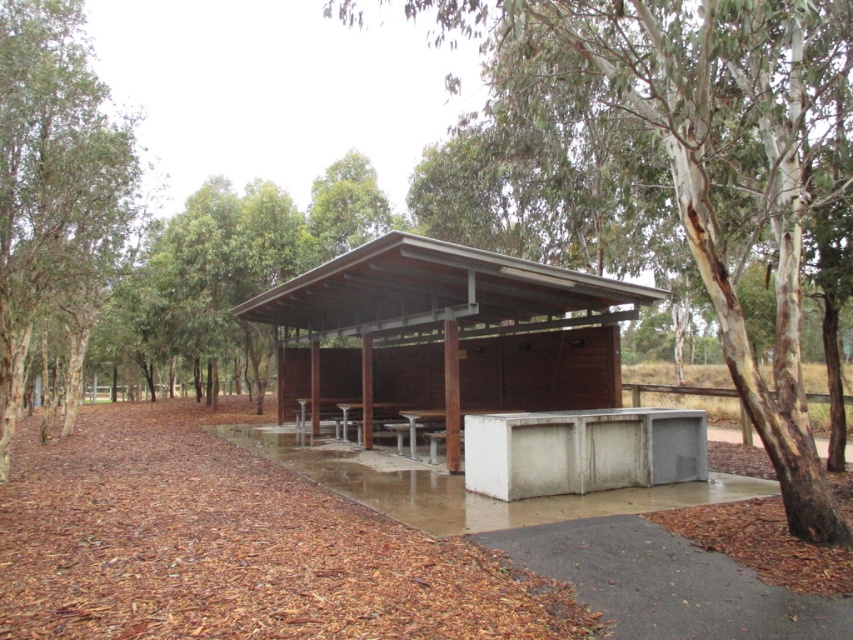
Does white bark tree at center come behind metallic silver picnic table at center?

No, it is in front of metallic silver picnic table at center.

Who is more forward, (x=722, y=304) or (x=424, y=413)?

Point (x=722, y=304) is more forward.

The image size is (853, 640). Describe the element at coordinates (721, 161) in the screenshot. I see `white bark tree at center` at that location.

You are a GUI agent. You are given a task and a screenshot of the screen. Output one action in this format:
    pyautogui.click(x=<x>, y=<y>)
    Task: Click on the white bark tree at center
    This screenshot has width=853, height=640.
    Given the screenshot: What is the action you would take?
    pyautogui.click(x=721, y=161)

Does brown wood/hardwood hut at center have a smaller size compared to green leafy tree at left?

Actually, brown wood/hardwood hut at center might be larger than green leafy tree at left.

Is point (537, 344) positioned in front of point (90, 134)?

No, it is behind (90, 134).

I want to click on brown wood/hardwood hut at center, so click(445, 332).

Between point (364, 321) and point (424, 416), which one is positioned in front?

Point (424, 416) is in front.

Looking at this image, is brown wood/hardwood hut at center to the left of metallic silver picnic table at center from the viewer's perspective?

Correct, you'll find brown wood/hardwood hut at center to the left of metallic silver picnic table at center.

This screenshot has height=640, width=853. In order to click on brown wood/hardwood hut at center in this screenshot , I will do `click(445, 332)`.